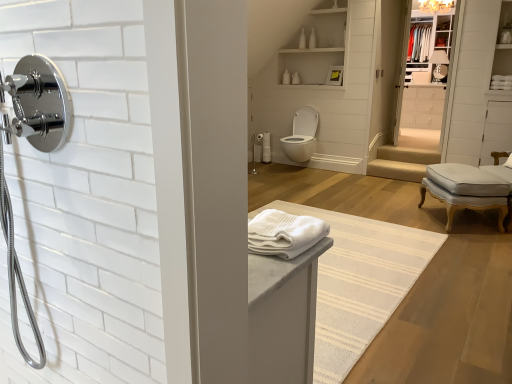
Question: From the image's perspective, is white glossy cabinet at upper right positioned above or below white cotton bath towel at center, marked as the first bath towel in a back-to-front arrangement?

Choices:
 (A) below
 (B) above

Answer: (A)

Question: Is white glossy cabinet at upper right situated inside white cotton bath towel at center, marked as the first bath towel in a back-to-front arrangement, or outside?

Choices:
 (A) outside
 (B) inside

Answer: (A)

Question: Estimate the real-world distances between objects in this image. Which object is closer to the matte white light fixture at upper center?

Choices:
 (A) white glossy cabinet at upper right
 (B) white cotton bath towel at center, marked as the 2th bath towel in a front-to-back arrangement
 (C) white glossy medicine cabinet at upper right, placed as the first medicine cabinet when sorted from back to front
 (D) white glossy toilet at center
 (E) beige fabric stair at center

Answer: (B)

Question: Which object is positioned farthest from the white soft towel at center, the 2th bath towel viewed from the top?

Choices:
 (A) white glossy shelves at upper center, which ranks as the 1th medicine cabinet in left-to-right order
 (B) polished chrome shower at center, which ranks as the second shower in left-to-right order
 (C) white glossy toilet at center
 (D) beige fabric stair at center
 (E) light gray fabric ottoman at right

Answer: (B)